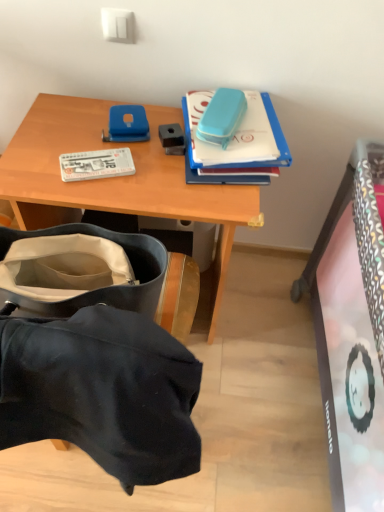
Question: Can you confirm if white matte book at left, the 2th book viewed from the right, is positioned to the right of wooden desk at upper center?

Choices:
 (A) yes
 (B) no

Answer: (B)

Question: Is the depth of white matte book at left, the 1th book when ordered from left to right, greater than that of wooden desk at upper center?

Choices:
 (A) yes
 (B) no

Answer: (A)

Question: Is white matte book at left, the 1th book when ordered from left to right, to the left of wooden desk at upper center from the viewer's perspective?

Choices:
 (A) no
 (B) yes

Answer: (B)

Question: Would you consider white matte book at left, the 1th book when ordered from left to right, to be distant from wooden desk at upper center?

Choices:
 (A) yes
 (B) no

Answer: (B)

Question: Is white matte book at left, the 1th book when ordered from left to right, aimed at wooden desk at upper center?

Choices:
 (A) no
 (B) yes

Answer: (B)

Question: Is white matte book at left, the 2th book viewed from the right, bigger than wooden desk at upper center?

Choices:
 (A) yes
 (B) no

Answer: (B)

Question: From the image's perspective, is wooden desk at upper center over blue matte case at upper right, arranged as the second book when viewed from the left?

Choices:
 (A) no
 (B) yes

Answer: (A)

Question: From a real-world perspective, is wooden desk at upper center beneath blue matte case at upper right, arranged as the second book when viewed from the left?

Choices:
 (A) yes
 (B) no

Answer: (A)

Question: Is wooden desk at upper center directly adjacent to blue matte case at upper right, arranged as the second book when viewed from the left?

Choices:
 (A) no
 (B) yes

Answer: (A)

Question: From the image's perspective, is wooden desk at upper center beneath blue matte case at upper right, arranged as the second book when viewed from the left?

Choices:
 (A) no
 (B) yes

Answer: (B)

Question: Is wooden desk at upper center positioned before blue matte case at upper right, the first book when ordered from right to left?

Choices:
 (A) no
 (B) yes

Answer: (B)

Question: Considering the relative sizes of wooden desk at upper center and blue matte case at upper right, the first book when ordered from right to left, in the image provided, is wooden desk at upper center shorter than blue matte case at upper right, the first book when ordered from right to left,?

Choices:
 (A) no
 (B) yes

Answer: (A)

Question: Is white matte book at left, the 1th book when ordered from left to right, shorter than blue matte case at upper right, the first book when ordered from right to left?

Choices:
 (A) no
 (B) yes

Answer: (B)